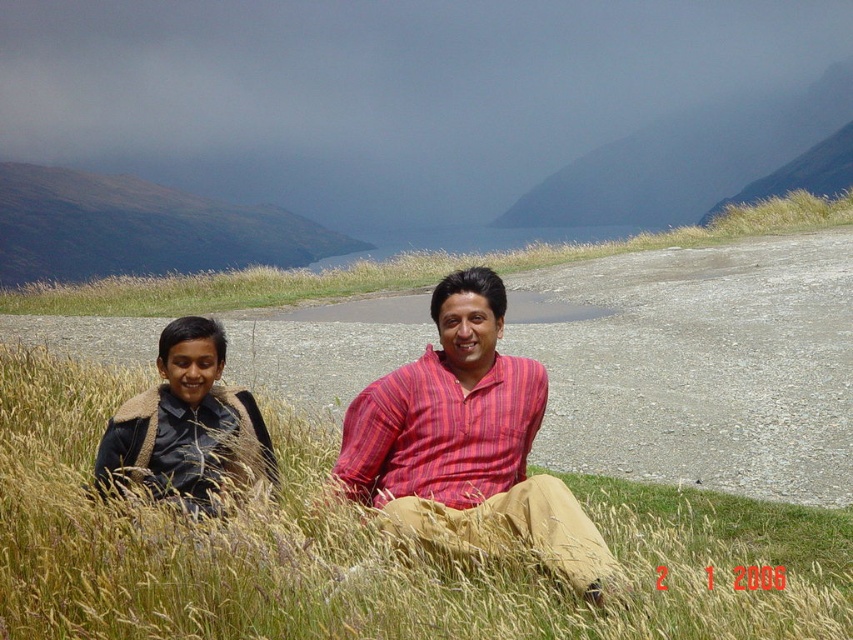
Question: Is grassy at center above black leather jacket at left?

Choices:
 (A) no
 (B) yes

Answer: (B)

Question: Which of the following is the farthest from the observer?

Choices:
 (A) brown grassy at lower left
 (B) grassy at center
 (C) black leather jacket at left

Answer: (B)

Question: Which is nearer to the smooth grassy hillside at upper center?

Choices:
 (A) green grassy hillside at upper left
 (B) black leather jacket at left

Answer: (A)

Question: Which object is the farthest from the green grassy hillside at upper left?

Choices:
 (A) black leather jacket at left
 (B) brown grassy at lower left
 (C) grassy at center
 (D) smooth grassy hillside at upper center

Answer: (B)

Question: In this image, where is green grassy hillside at upper left located relative to smooth grassy hillside at upper center?

Choices:
 (A) below
 (B) above

Answer: (A)

Question: In this image, where is striped cotton shirt at center located relative to black leather jacket at left?

Choices:
 (A) right
 (B) left

Answer: (A)